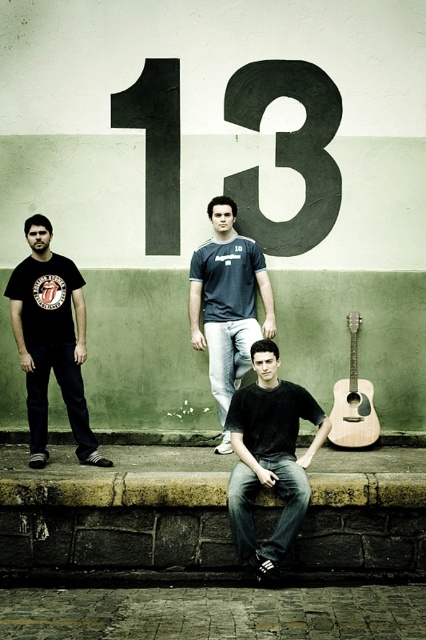
Is brown stone ledge at lower center positioned behind dark blue t-shirt at center?

No, it is not.

Does brown stone ledge at lower center lie in front of dark blue t-shirt at center?

Yes, brown stone ledge at lower center is closer to the viewer.

Is point (403, 490) more distant than point (233, 282)?

No.

Find the location of `brown stone ledge at lower center`. brown stone ledge at lower center is located at coordinates (118, 490).

Does dark blue t-shirt at center come behind natural wood acoustic guitar at lower right?

No, it is not.

Who is more forward, (230, 355) or (371, 408)?

Point (230, 355) is more forward.

The height and width of the screenshot is (640, 426). What are the coordinates of `dark blue t-shirt at center` in the screenshot? It's located at (227, 305).

Does point (265, 360) come farther from viewer compared to point (20, 353)?

That is False.

Which is in front, point (271, 384) or point (45, 304)?

Point (271, 384)

What do you see at coordinates (270, 458) in the screenshot?
I see `black cotton shirt at center` at bounding box center [270, 458].

What are the coordinates of `black cotton shirt at center` in the screenshot? It's located at (270, 458).